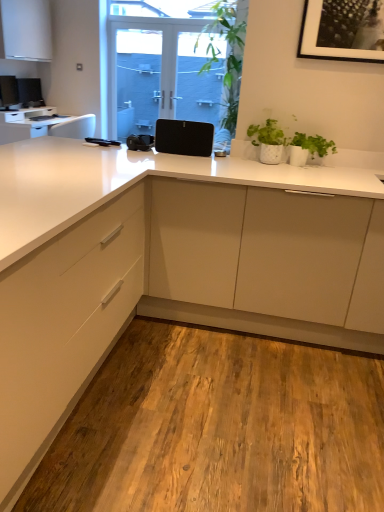
Locate an element on the screen. white textured pot at center, the 1th houseplant when ordered from left to right is located at coordinates (268, 141).

This screenshot has height=512, width=384. What do you see at coordinates (63, 326) in the screenshot?
I see `white matte drawer at center` at bounding box center [63, 326].

Measure the distance between green leafy plant at upper center and camera.

4.12 meters.

Describe the element at coordinates (228, 55) in the screenshot. I see `green leafy plant at upper center` at that location.

At what (x,y) coordinates should I click in order to perform the action: click on transparent glass screen door at upper center, the 2th screen door positioned from the left. Please return your answer as a coordinate pair (x, y). The width and height of the screenshot is (384, 512). Looking at the image, I should click on (201, 84).

Image resolution: width=384 pixels, height=512 pixels. Identify the location of green matte plant at upper right, the first houseplant in the right-to-left sequence. (309, 148).

What do you see at coordinates (309, 148) in the screenshot? This screenshot has height=512, width=384. I see `green matte plant at upper right, placed as the second houseplant when sorted from left to right` at bounding box center [309, 148].

Where is `white glossy countertop at center, which ranks as the second countertop in top-to-bottom order`? This screenshot has width=384, height=512. white glossy countertop at center, which ranks as the second countertop in top-to-bottom order is located at coordinates (168, 265).

What's the angular difference between green matte plant at upper right, placed as the second houseplant when sorted from left to right, and white matte drawer at center's facing directions?

The angular difference between green matte plant at upper right, placed as the second houseplant when sorted from left to right, and white matte drawer at center is 90.1 degrees.

Between green matte plant at upper right, placed as the second houseplant when sorted from left to right, and white matte drawer at center, which one has larger size?

Bigger between the two is white matte drawer at center.

Between green matte plant at upper right, placed as the second houseplant when sorted from left to right, and white matte drawer at center, which one has less height?

green matte plant at upper right, placed as the second houseplant when sorted from left to right.

The height and width of the screenshot is (512, 384). In order to click on drawer in front of the transparent glass screen door at upper center, placed as the 1th screen door when sorted from right to left in this screenshot , I will do `click(63, 326)`.

Which is in front, point (215, 81) or point (55, 261)?

The point (55, 261) is closer to the camera.

Would you say transparent glass screen door at upper center, the 2th screen door positioned from the left, is outside white matte drawer at center?

Absolutely, transparent glass screen door at upper center, the 2th screen door positioned from the left, is external to white matte drawer at center.

Which of these two, transparent glass screen door at upper center, the 2th screen door positioned from the left, or white matte drawer at center, stands taller?

Standing taller between the two is transparent glass screen door at upper center, the 2th screen door positioned from the left.

Is white glossy countertop at upper left, which is the 2th countertop in bottom-to-top order, looking in the opposite direction of black matte picture frame at upper right?

No.

From a real-world perspective, is white glossy countertop at upper left, the 2th countertop positioned from the front, over black matte picture frame at upper right?

No, from a real-world perspective, white glossy countertop at upper left, the 2th countertop positioned from the front, is not over black matte picture frame at upper right

Considering the relative sizes of white glossy countertop at upper left, placed as the first countertop when sorted from back to front, and black matte picture frame at upper right in the image provided, is white glossy countertop at upper left, placed as the first countertop when sorted from back to front, thinner than black matte picture frame at upper right?

No.

Is white glossy countertop at upper left, which is the 2th countertop in bottom-to-top order, in front of or behind black matte picture frame at upper right in the image?

white glossy countertop at upper left, which is the 2th countertop in bottom-to-top order, is positioned farther from the viewer than black matte picture frame at upper right.

Does point (75, 117) appear closer or farther from the camera than point (204, 30)?

Point (75, 117) is positioned closer to the camera compared to point (204, 30).

The height and width of the screenshot is (512, 384). Find the location of `plant that is above the white glossy countertop at upper left, which is the 2th countertop in bottom-to-top order (from the image's perspective)`. plant that is above the white glossy countertop at upper left, which is the 2th countertop in bottom-to-top order (from the image's perspective) is located at coordinates [228, 55].

Based on the photo, between white glossy countertop at upper left, the 2th countertop positioned from the front, and green leafy plant at upper center, which one appears on the right side from the viewer's perspective?

green leafy plant at upper center is more to the right.

Can we say white glossy countertop at upper left, which is the 2th countertop in bottom-to-top order, lies outside green leafy plant at upper center?

That's correct, white glossy countertop at upper left, which is the 2th countertop in bottom-to-top order, is outside of green leafy plant at upper center.

Is green matte plant at upper right, placed as the second houseplant when sorted from left to right, taller or shorter than black matte speaker at center?

Clearly, green matte plant at upper right, placed as the second houseplant when sorted from left to right, is shorter compared to black matte speaker at center.

Is point (318, 139) closer or farther from the camera than point (168, 135)?

Point (318, 139) is closer to the camera than point (168, 135).

Is green matte plant at upper right, placed as the second houseplant when sorted from left to right, placed right next to black matte speaker at center?

No, green matte plant at upper right, placed as the second houseplant when sorted from left to right, is not making contact with black matte speaker at center.

From a real-world perspective, is green matte plant at upper right, the first houseplant in the right-to-left sequence, positioned over black matte speaker at center based on gravity?

Incorrect, from a real-world perspective, green matte plant at upper right, the first houseplant in the right-to-left sequence, is lower than black matte speaker at center.

Is white glossy countertop at center, positioned as the 2th countertop in back-to-front order, directly adjacent to white matte drawer at center?

No, white glossy countertop at center, positioned as the 2th countertop in back-to-front order, is not touching white matte drawer at center.

Which object is thinner, white glossy countertop at center, placed as the first countertop when sorted from right to left, or white matte drawer at center?

white matte drawer at center.

Who is bigger, white glossy countertop at center, which appears as the second countertop when viewed from the left, or white matte drawer at center?

With larger size is white glossy countertop at center, which appears as the second countertop when viewed from the left.

From the image's perspective, is white glossy countertop at center, which appears as the second countertop when viewed from the left, on top of white matte drawer at center?

Actually, white glossy countertop at center, which appears as the second countertop when viewed from the left, appears below white matte drawer at center in the image.

Are white matte cabinet at upper left and satin black screen door at center, which appears as the first screen door when viewed from the left, located far from each other?

white matte cabinet at upper left is far away from satin black screen door at center, which appears as the first screen door when viewed from the left.

Considering the points (18, 44) and (128, 61), which point is in front, point (18, 44) or point (128, 61)?

The point (128, 61) is more forward.

Considering the sizes of objects white matte cabinet at upper left and satin black screen door at center, which ranks as the second screen door in right-to-left order, in the image provided, who is thinner, white matte cabinet at upper left or satin black screen door at center, which ranks as the second screen door in right-to-left order,?

With smaller width is satin black screen door at center, which ranks as the second screen door in right-to-left order.

At what (x,y) coordinates should I click in order to perform the action: click on the 1st screen door to the right of the white matte cabinet at upper left, counting from the anchor's position. Please return your answer as a coordinate pair (x, y). Image resolution: width=384 pixels, height=512 pixels. Looking at the image, I should click on (168, 78).

Find the location of a particular element. drawer to the left of green matte plant at upper right, the first houseplant in the right-to-left sequence is located at coordinates (63, 326).

I want to click on the 2nd screen door counting from the right side of the white matte drawer at center, so click(x=201, y=84).

Looking at the image, which one is located further to black matte picture frame at upper right, white matte drawer at center or white glossy countertop at center, which ranks as the second countertop in top-to-bottom order?

white matte drawer at center is further to black matte picture frame at upper right.

Which object lies further to the anchor point white matte drawer at center, black matte picture frame at upper right or white matte cabinet at upper left?

white matte cabinet at upper left.

Estimate the real-world distances between objects in this image. Which object is closer to white glossy countertop at center, placed as the first countertop when sorted from right to left, white matte drawer at center or green matte plant at upper right, placed as the second houseplant when sorted from left to right?

white matte drawer at center.

Based on the photo, estimate the real-world distances between objects in this image. Which object is further from white matte drawer at center, green leafy plant at upper center or green matte plant at upper right, placed as the second houseplant when sorted from left to right?

Based on the image, green leafy plant at upper center appears to be further to white matte drawer at center.

Estimate the real-world distances between objects in this image. Which object is closer to green leafy plant at upper center, black matte speaker at center or green matte plant at upper right, placed as the second houseplant when sorted from left to right?

Among the two, black matte speaker at center is located nearer to green leafy plant at upper center.

Estimate the real-world distances between objects in this image. Which object is closer to black matte picture frame at upper right, transparent glass screen door at upper center, the 2th screen door positioned from the left, or white textured pot at center, the 1th houseplant when ordered from left to right?

white textured pot at center, the 1th houseplant when ordered from left to right.

Considering their positions, is transparent glass screen door at upper center, placed as the 1th screen door when sorted from right to left, positioned closer to white matte drawer at center than green matte plant at upper right, placed as the second houseplant when sorted from left to right?

green matte plant at upper right, placed as the second houseplant when sorted from left to right, is positioned closer to the anchor white matte drawer at center.

Estimate the real-world distances between objects in this image. Which object is closer to green matte plant at upper right, placed as the second houseplant when sorted from left to right, white matte drawer at center or green leafy plant at upper center?

Based on the image, white matte drawer at center appears to be nearer to green matte plant at upper right, placed as the second houseplant when sorted from left to right.

The width and height of the screenshot is (384, 512). I want to click on countertop positioned between white textured pot at center, the 2th houseplant in the right-to-left sequence, and transparent glass screen door at upper center, placed as the 1th screen door when sorted from right to left, from near to far, so click(43, 124).

The width and height of the screenshot is (384, 512). In order to click on cabinetry located between white matte drawer at center and white glossy countertop at upper left, marked as the first countertop in a top-to-bottom arrangement, in the depth direction in this screenshot , I will do `click(25, 30)`.

The height and width of the screenshot is (512, 384). I want to click on speaker between white glossy countertop at center, which appears as the second countertop when viewed from the left, and white matte cabinet at upper left in the front-back direction, so click(x=184, y=137).

I want to click on plant between white glossy countertop at center, which appears as the second countertop when viewed from the left, and transparent glass screen door at upper center, the 2th screen door positioned from the left, along the z-axis, so click(228, 55).